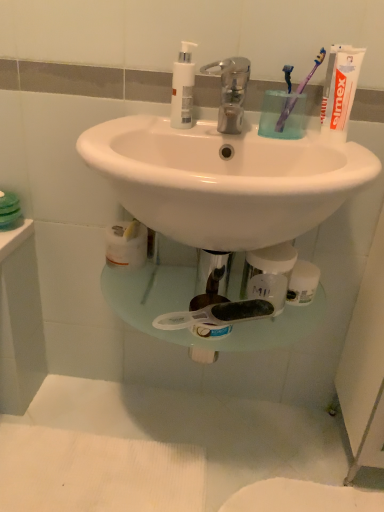
Locate an element on the screen. This screenshot has height=512, width=384. vacant region to the left of purple plastic toothbrush at upper right, placed as the 1th toothbrush when sorted from left to right is located at coordinates (221, 127).